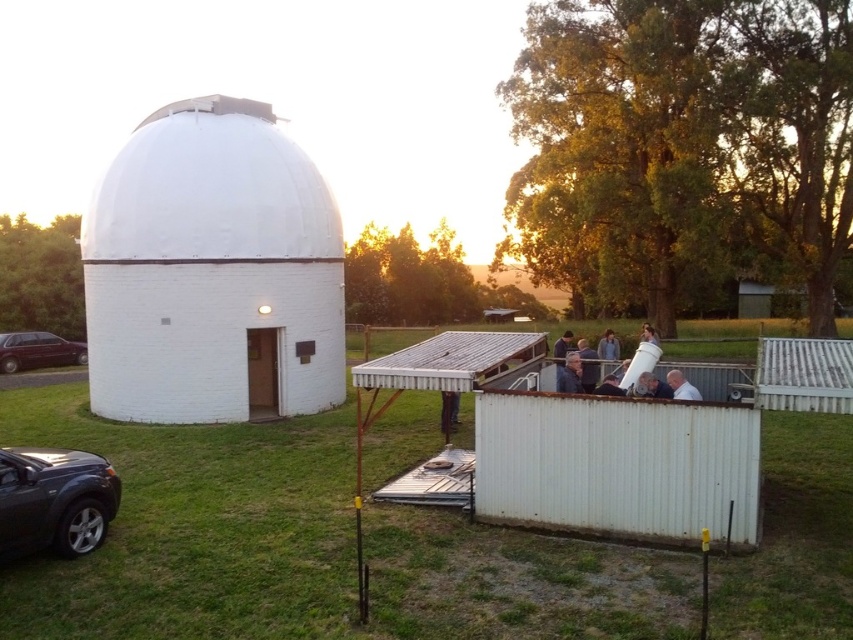
You are a visitor at the observatory and want to take a photo of the light brown wooden telescope at center without the shiny maroon sedan at lower left blocking the view. Which direction should you move to ensure the sedan is out of frame?

The light brown wooden telescope at center is behind the shiny maroon sedan at lower left, so moving behind the sedan would place the telescope in front of it, but since the telescope is already behind the sedan, you should move to a position where the sedan is between you and the telescope. Alternatively, moving to the side of the sedan might allow you to see the telescope around the sedan. However, since the telescope is behind the sedan, the best way to avoid the sedan blocking the view is to move behind

You are planning to take a photo of the light brown wooden telescope at center and want to ensure the dark blue jacket at center doesn t block the view. Based on their sizes, which object should you position closer to the camera to avoid obstruction?

Since the dark blue jacket at center is larger than the light brown wooden telescope at center, positioning the dark blue jacket at center closer to the camera would make it appear even larger and more likely to block the telescope. To avoid obstruction, you should position the light brown wooden telescope at center closer to the camera so that its smaller size reduces the chance of being blocked by the jacket.